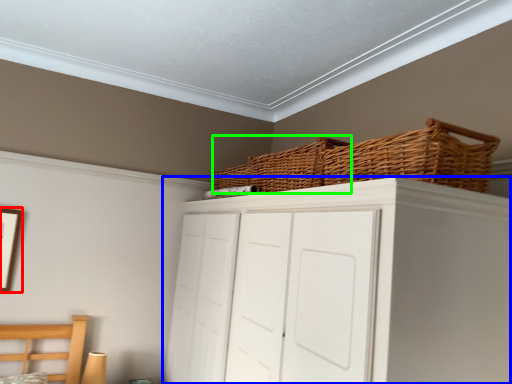
Question: Based on their relative distances, which object is nearer to picture frame (highlighted by a red box)? Choose from cupboard (highlighted by a blue box) and basket (highlighted by a green box).

Choices:
 (A) cupboard
 (B) basket

Answer: (B)